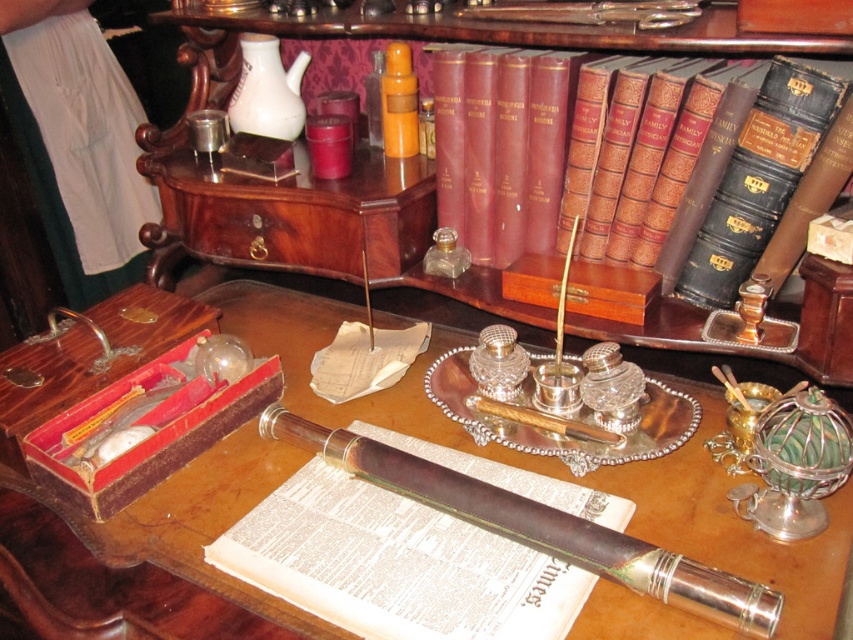
Question: Which of the following is the closest to the observer?

Choices:
 (A) polished silver pen at center
 (B) leather-bound book at upper right
 (C) leather-bound books at upper center

Answer: (A)

Question: Is brown wooden table at center smaller than polished silver pen at center?

Choices:
 (A) no
 (B) yes

Answer: (A)

Question: Which point is closer to the camera?

Choices:
 (A) leather-bound book at upper right
 (B) polished silver pen at center
 (C) leather-bound books at upper center

Answer: (B)

Question: Does leather-bound books at upper center appear on the right side of polished silver pen at center?

Choices:
 (A) no
 (B) yes

Answer: (A)

Question: Which of these objects is positioned farthest from the leather-bound book at upper right?

Choices:
 (A) polished silver pen at center
 (B) leather-bound books at upper center
 (C) brown wooden table at center

Answer: (A)

Question: Where is brown wooden table at center located in relation to polished silver pen at center in the image?

Choices:
 (A) right
 (B) left

Answer: (B)